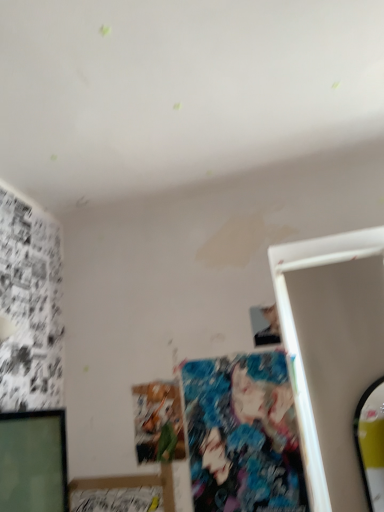
Question: Considering the positions of matte paper poster at center, positioned as the 2th art in right-to-left order, and colorful fabric poster at center, acting as the second art starting from the left, in the image, is matte paper poster at center, positioned as the 2th art in right-to-left order, taller or shorter than colorful fabric poster at center, acting as the second art starting from the left,?

Choices:
 (A) tall
 (B) short

Answer: (B)

Question: Considering the positions of matte paper poster at center, positioned as the 2th art in right-to-left order, and colorful fabric poster at center, acting as the second art starting from the left, in the image, is matte paper poster at center, positioned as the 2th art in right-to-left order, wider or thinner than colorful fabric poster at center, acting as the second art starting from the left,?

Choices:
 (A) wide
 (B) thin

Answer: (A)

Question: Which object is positioned farthest from the matte paper poster at center, which is counted as the 1th art, starting from the left?

Choices:
 (A) smooth black phone at upper right
 (B) colorful fabric poster at center, acting as the 1th art starting from the right

Answer: (A)

Question: Which is nearer to the colorful fabric poster at center, acting as the second art starting from the left?

Choices:
 (A) matte paper poster at center, which is counted as the 1th art, starting from the left
 (B) smooth black phone at upper right

Answer: (A)